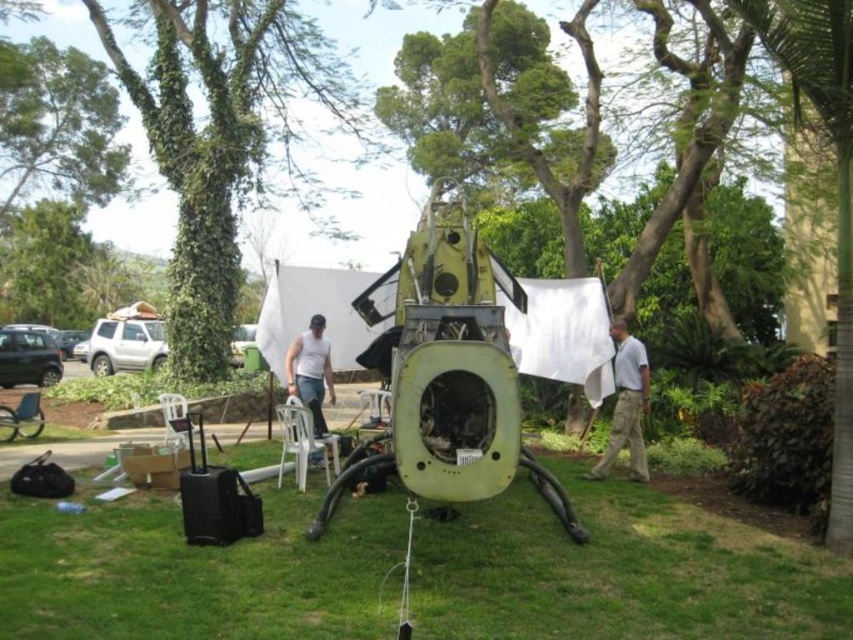
Does green grass at center have a lesser width compared to white cotton shirt at center?

Incorrect, green grass at center's width is not less than white cotton shirt at center's.

Can you confirm if green grass at center is positioned to the right of white cotton shirt at center?

Incorrect, green grass at center is not on the right side of white cotton shirt at center.

Where is `green grass at center`? green grass at center is located at coordinates (619, 572).

Locate an element on the screen. Image resolution: width=853 pixels, height=640 pixels. green grass at center is located at coordinates (619, 572).

Which is in front, point (614, 529) or point (242, 141)?

Point (614, 529) is in front.

This screenshot has height=640, width=853. Describe the element at coordinates (619, 572) in the screenshot. I see `green grass at center` at that location.

Describe the element at coordinates (619, 572) in the screenshot. I see `green grass at center` at that location.

Identify the location of green grass at center. coord(619,572).

Describe the element at coordinates (619, 572) in the screenshot. The image size is (853, 640). I see `green grass at center` at that location.

Is point (154, 625) in front of point (291, 371)?

Yes.

Image resolution: width=853 pixels, height=640 pixels. Identify the location of green grass at center. (619, 572).